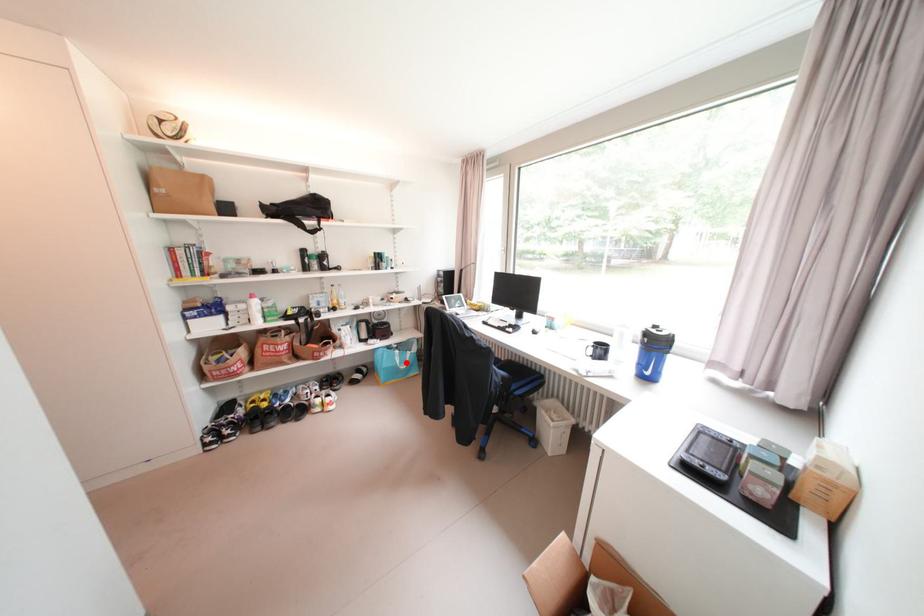
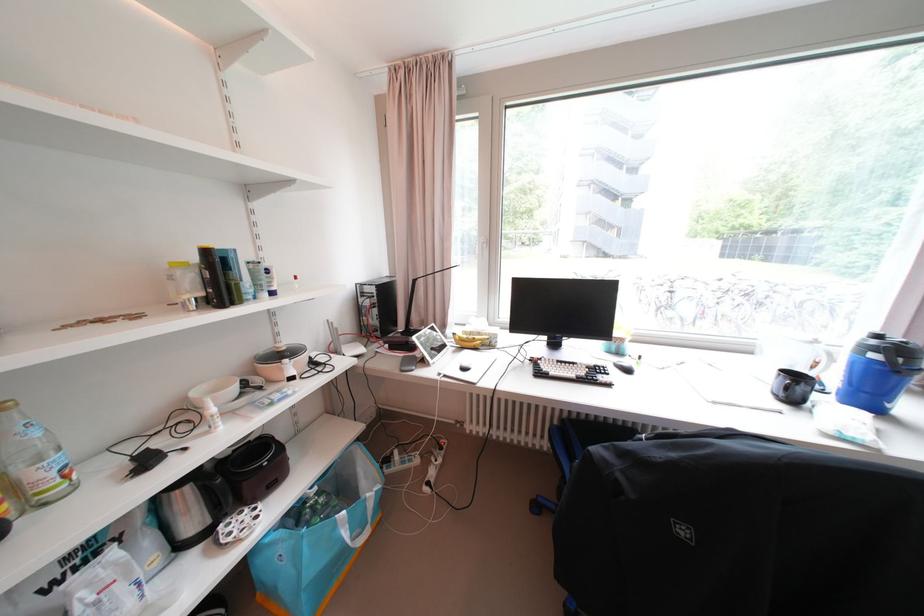
Where in the second image is the point corresponding to the highlighted location from the first image?

(354, 537)